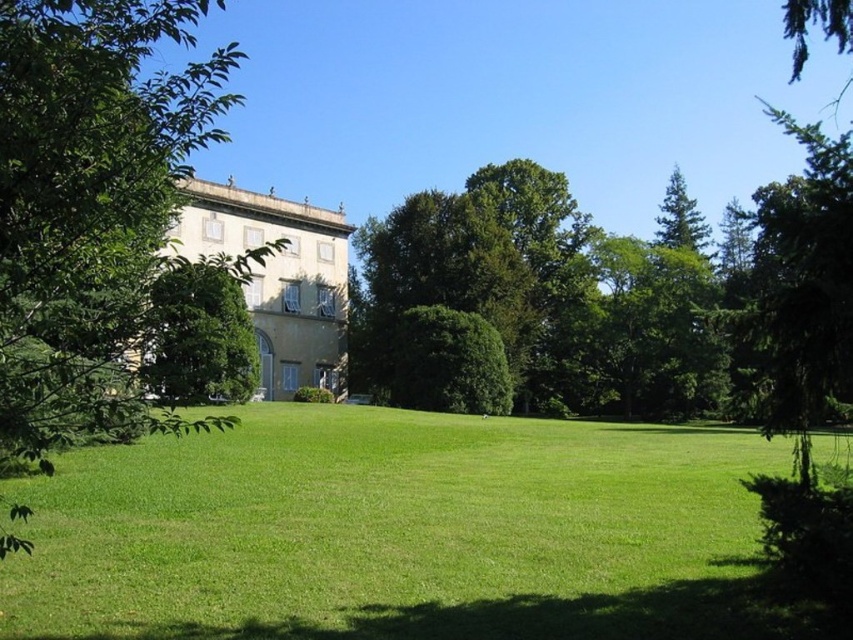
From the picture: You are a gardener who needs to mow the lawn. You are currently standing near the green leafy tree at left. Which direction should you move to reach the green grass at center?

The green grass at center is positioned on the right side of green leafy tree at left, so you should move to the right to reach it.

You are a gardener planning to plant a new tree in this outdoor area. You want to ensure that the new tree will not block the view of the villa from the lawn. Which existing tree, the green leafy tree at left or the green leafy tree at right, has a wider spread and might be more likely to obstruct the view if planted closer to the villa?

The green leafy tree at right has a wider spread than the green leafy tree at left, so it is more likely to obstruct the view if planted closer to the villa.